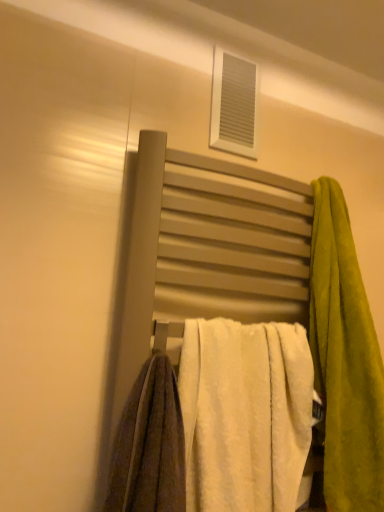
Question: Is green plush towel at right, which is the 2th towel in left-to-right order, placed right next to matte gray towel rack at center?

Choices:
 (A) no
 (B) yes

Answer: (A)

Question: Is green plush towel at right, the first towel from the right, closer to the viewer compared to matte gray towel rack at center?

Choices:
 (A) yes
 (B) no

Answer: (B)

Question: Is green plush towel at right, the first towel from the right, far from matte gray towel rack at center?

Choices:
 (A) yes
 (B) no

Answer: (B)

Question: Is green plush towel at right, which is the 2th towel in left-to-right order, outside matte gray towel rack at center?

Choices:
 (A) no
 (B) yes

Answer: (B)

Question: Is green plush towel at right, which is the 2th towel in left-to-right order, thinner than matte gray towel rack at center?

Choices:
 (A) yes
 (B) no

Answer: (B)

Question: From a real-world perspective, is green plush towel at right, which is the 2th towel in left-to-right order, above or below matte gray towel rack at center?

Choices:
 (A) above
 (B) below

Answer: (A)

Question: Is green plush towel at right, the first towel from the right, to the left or to the right of matte gray towel rack at center in the image?

Choices:
 (A) left
 (B) right

Answer: (B)

Question: From their relative heights in the image, would you say green plush towel at right, the first towel from the right, is taller or shorter than matte gray towel rack at center?

Choices:
 (A) short
 (B) tall

Answer: (A)

Question: From the image's perspective, is green plush towel at right, which is the 2th towel in left-to-right order, located above or below matte gray towel rack at center?

Choices:
 (A) above
 (B) below

Answer: (A)

Question: Choose the correct answer: Is white fluffy towel at center, the 1th towel when ordered from left to right, inside white plastic vent at upper center or outside it?

Choices:
 (A) inside
 (B) outside

Answer: (B)

Question: From the image's perspective, is white fluffy towel at center, the second towel viewed from the right, above or below white plastic vent at upper center?

Choices:
 (A) below
 (B) above

Answer: (A)

Question: From a real-world perspective, is white fluffy towel at center, the 1th towel when ordered from left to right, positioned above or below white plastic vent at upper center?

Choices:
 (A) above
 (B) below

Answer: (B)

Question: In terms of width, does white fluffy towel at center, the 1th towel when ordered from left to right, look wider or thinner when compared to white plastic vent at upper center?

Choices:
 (A) wide
 (B) thin

Answer: (A)

Question: Is point (251, 141) closer or farther from the camera than point (347, 372)?

Choices:
 (A) farther
 (B) closer

Answer: (A)

Question: Is white plastic vent at upper center spatially inside green plush towel at right, the first towel from the right, or outside of it?

Choices:
 (A) inside
 (B) outside

Answer: (B)